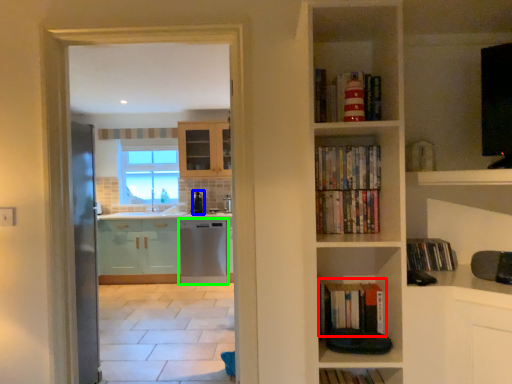
Question: Estimate the real-world distances between objects in this image. Which object is farther from book (highlighted by a red box), appliance (highlighted by a blue box) or dish washer (highlighted by a green box)?

Choices:
 (A) appliance
 (B) dish washer

Answer: (A)